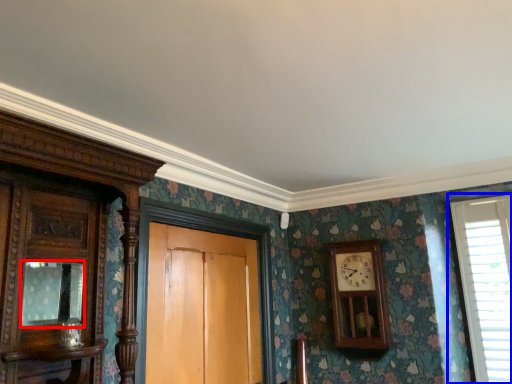
Question: Which object appears closest to the camera in this image, mirror (highlighted by a red box) or window (highlighted by a blue box)?

Choices:
 (A) mirror
 (B) window

Answer: (A)